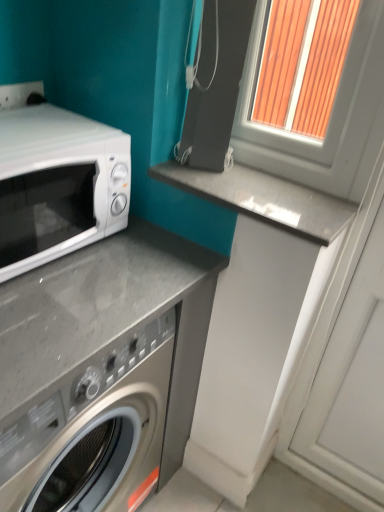
I want to click on blank space situated above gray polished stone counter top at center (from a real-world perspective), so click(257, 183).